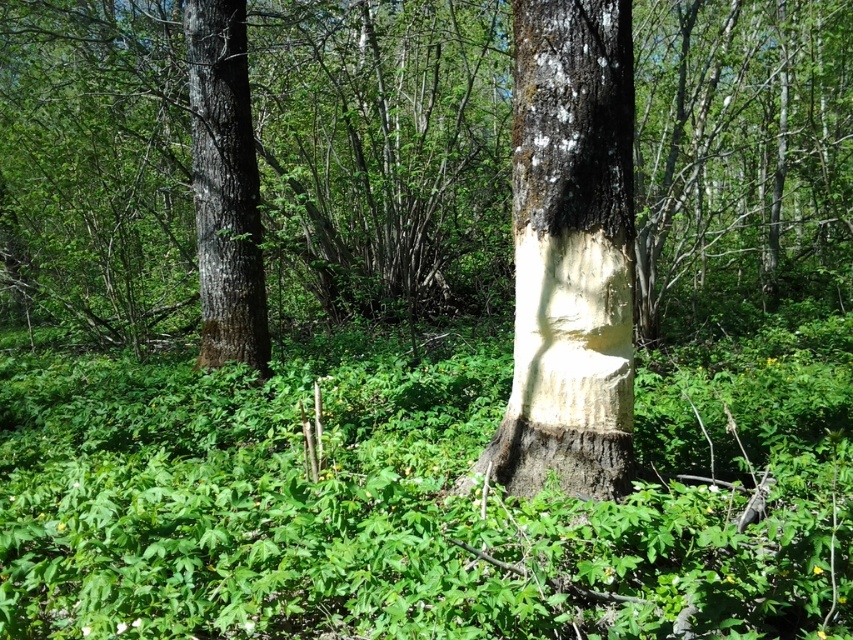
Question: Which point appears closest to the camera in this image?

Choices:
 (A) (578, 401)
 (B) (216, 177)

Answer: (A)

Question: Does smooth white bark at center lie behind smooth bark tree trunk at left?

Choices:
 (A) no
 (B) yes

Answer: (A)

Question: Can you confirm if smooth white bark at center is positioned below smooth bark tree trunk at left?

Choices:
 (A) no
 (B) yes

Answer: (B)

Question: Does smooth white bark at center appear under smooth bark tree trunk at left?

Choices:
 (A) yes
 (B) no

Answer: (A)